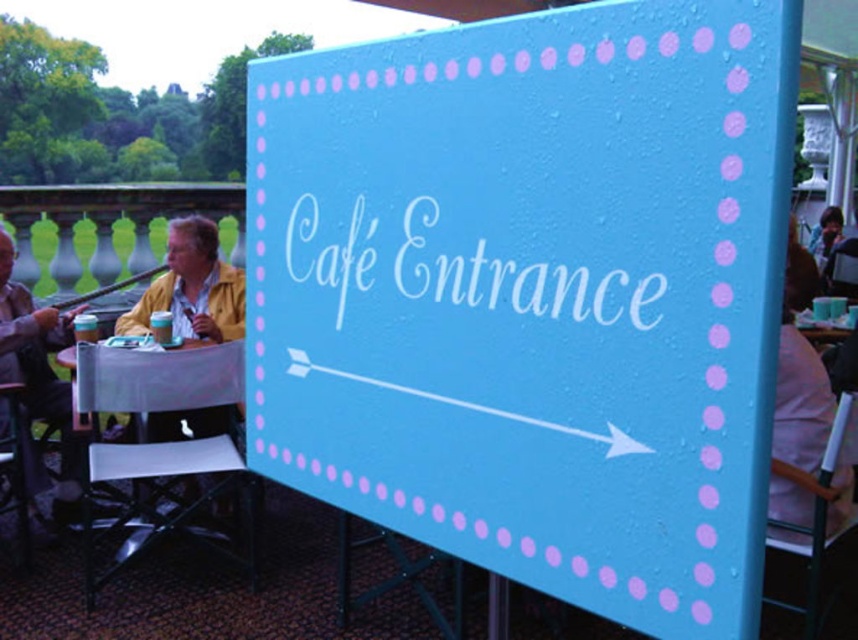
Question: Which of these objects is positioned farthest from the yellow matte jacket at left?

Choices:
 (A) white plastic table at lower left
 (B) matte yellow jacket at left
 (C) light blue painted board at center

Answer: (C)

Question: Does white plastic table at lower left appear on the right side of yellow matte jacket at left?

Choices:
 (A) no
 (B) yes

Answer: (B)

Question: Does light blue painted board at center have a larger size compared to yellow matte jacket at left?

Choices:
 (A) yes
 (B) no

Answer: (A)

Question: Which point is farther to the camera?

Choices:
 (A) (40, 388)
 (B) (490, 433)
 (C) (142, 480)
 (D) (245, 292)

Answer: (D)

Question: Which object is the closest to the yellow matte jacket at left?

Choices:
 (A) white plastic table at lower left
 (B) light blue painted board at center
 (C) matte yellow jacket at left

Answer: (C)

Question: Can you confirm if light blue painted board at center is positioned to the right of yellow matte jacket at left?

Choices:
 (A) no
 (B) yes

Answer: (B)